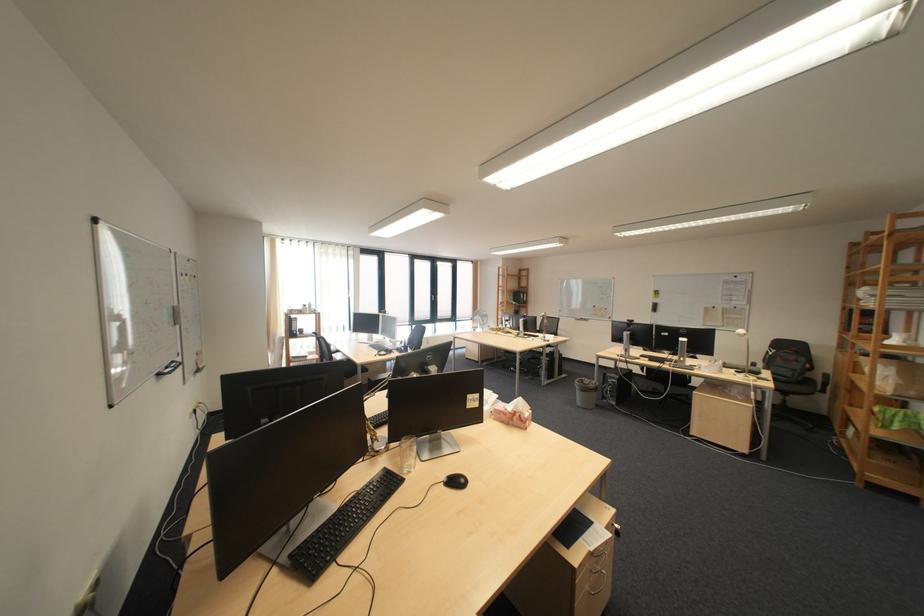
Where would you pull the pink tissue box? Please return your answer as a coordinate pair (x, y).

(513, 413)